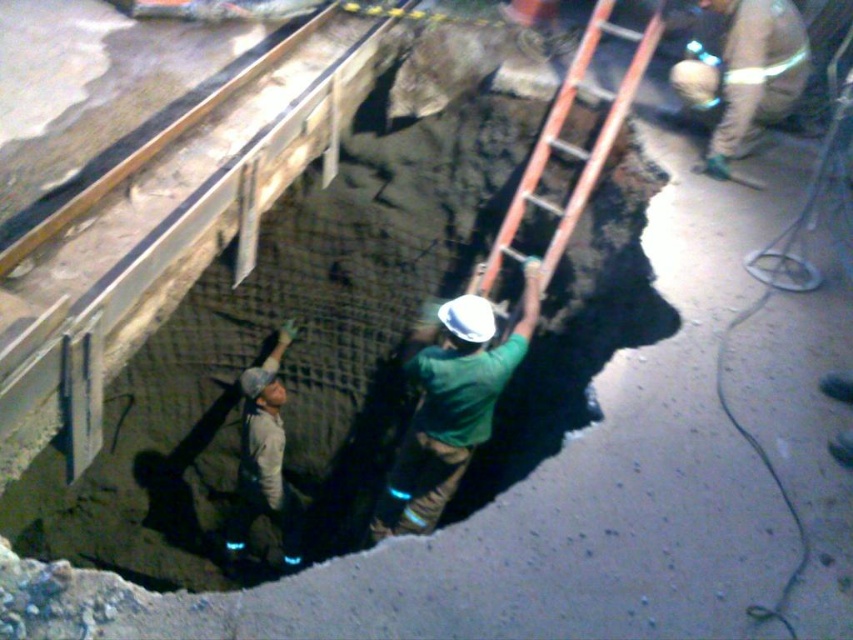
Question: Which point is farther to the camera?

Choices:
 (A) (732, 81)
 (B) (270, 508)
 (C) (390, 524)
 (D) (479, 268)

Answer: (B)

Question: Does green matte helmet at center appear over light brown leather pants at upper right?

Choices:
 (A) yes
 (B) no

Answer: (B)

Question: Is light brown leather pants at upper right further to the viewer compared to tan fabric construction worker at lower left?

Choices:
 (A) yes
 (B) no

Answer: (B)

Question: Which point appears closest to the camera in this image?

Choices:
 (A) (700, 88)
 (B) (486, 330)
 (C) (561, 108)

Answer: (B)

Question: Does orange wooden ladder at center appear over tan fabric construction worker at lower left?

Choices:
 (A) no
 (B) yes

Answer: (B)

Question: Based on their relative distances, which object is farther from the tan fabric construction worker at lower left?

Choices:
 (A) green matte helmet at center
 (B) orange wooden ladder at center
 (C) light brown leather pants at upper right

Answer: (C)